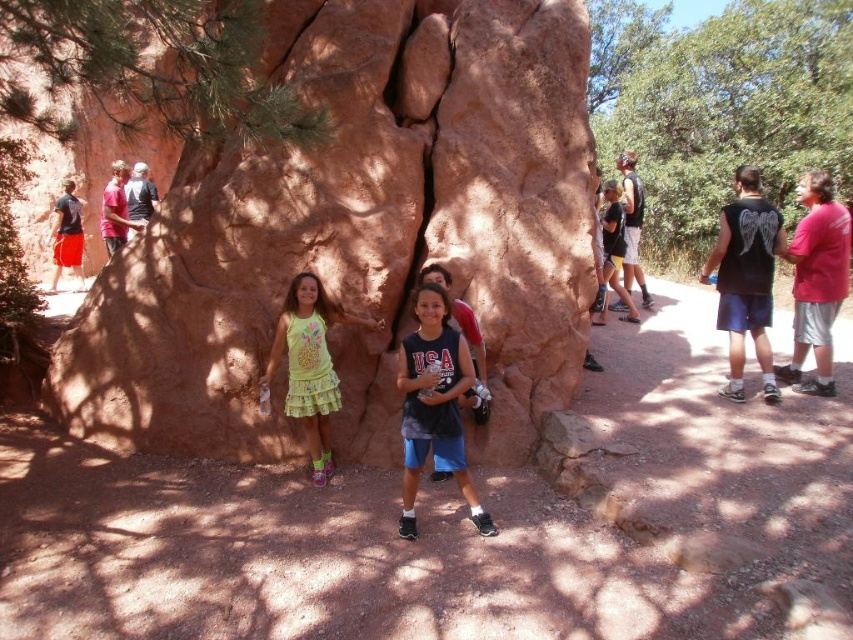
Which of these two, green pine tree at upper left or matte black shirt at left, stands taller?

matte black shirt at left

Which is behind, point (64, 49) or point (65, 227)?

Positioned behind is point (65, 227).

Does point (73, 19) come in front of point (61, 260)?

Yes, point (73, 19) is in front of point (61, 260).

The width and height of the screenshot is (853, 640). In order to click on green pine tree at upper left in this screenshot , I will do `click(149, 68)`.

Is dark blue t-shirt at center smaller than matte pink shirt at upper left?

Correct, dark blue t-shirt at center occupies less space than matte pink shirt at upper left.

Is dark blue t-shirt at center above matte pink shirt at upper left?

No.

Between point (439, 292) and point (106, 227), which one is positioned in front?

Point (439, 292) is more forward.

Locate an element on the screen. dark blue t-shirt at center is located at coordinates (434, 404).

Consider the image. Does green pine tree at upper left appear on the right side of matte pink shirt at upper left?

Yes, green pine tree at upper left is to the right of matte pink shirt at upper left.

Does green pine tree at upper left lie in front of matte pink shirt at upper left?

That is True.

Who is more forward, (21, 28) or (119, 216)?

Point (21, 28) is more forward.

Identify the location of green pine tree at upper left. (149, 68).